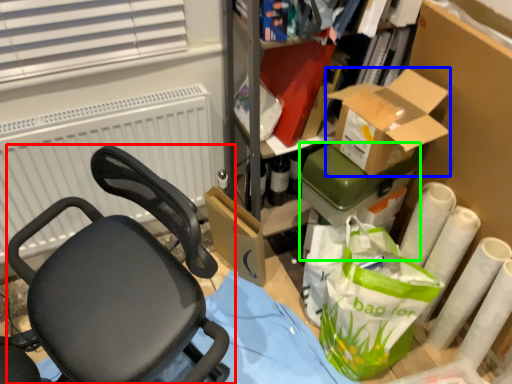
Question: Which object is positioned closest to chair (highlighted by a red box)? Select from box (highlighted by a blue box) and box (highlighted by a green box).

Choices:
 (A) box
 (B) box

Answer: (B)